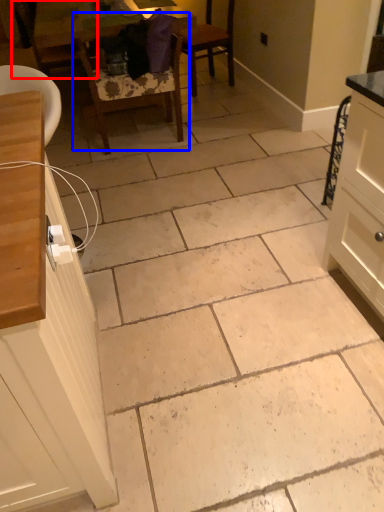
Question: Which point is closer to the camera, chair (highlighted by a red box) or chair (highlighted by a blue box)?

Choices:
 (A) chair
 (B) chair

Answer: (B)